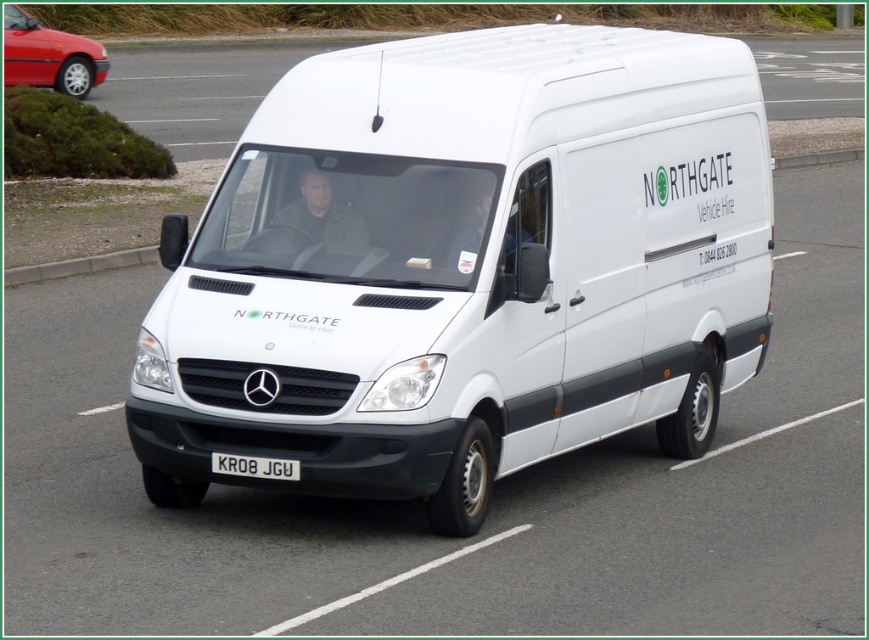
You are a delivery person who needs to attach a GPS tracker to the white matte van at center. The GPS tracker must be placed exactly 50 centimeters away from the white metallic license plate at center. Based on the image, can you determine if this placement is possible?

The white matte van at center and white metallic license plate at center are 47.84 centimeters apart from each other. Since the required distance is 50 centimeters, which is greater than the existing distance between them, the GPS tracker cannot be placed exactly 50 centimeters away from the license plate on the van.